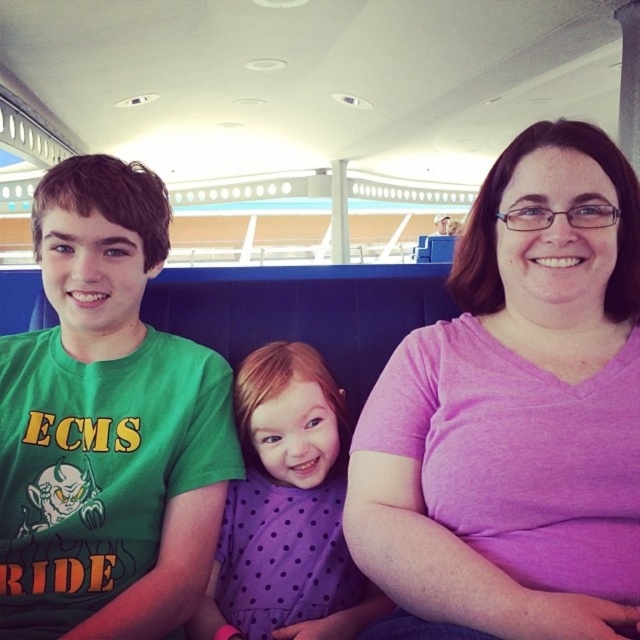
You are standing at the camera position and want to take a photo of all three people in the scene. The third person on the right is at point (124, 531). To ensure everyone is in frame, should you zoom in or out?

Since the third person on the right at point (124, 531) is 39.07 inches away from the camera, you should zoom out to include all three people in the frame.

You are a photographer trying to capture a group photo of the purple cotton shirt at center and the purple dotted dress at center. Since you want to ensure both subjects are in focus, you need to know their heights. Which one is taller?

The purple cotton shirt at center is taller than the purple dotted dress at center, so the photographer should adjust the camera angle to account for the height difference to ensure both are in focus.